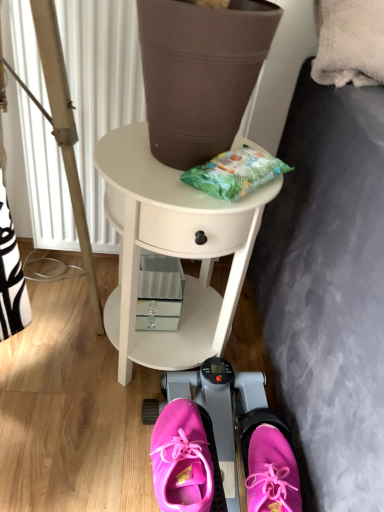
Question: Are wooden tripod at left and white glossy side table at center beside each other?

Choices:
 (A) no
 (B) yes

Answer: (A)

Question: Is wooden tripod at left taller than white glossy side table at center?

Choices:
 (A) yes
 (B) no

Answer: (A)

Question: Can you confirm if wooden tripod at left is smaller than white glossy side table at center?

Choices:
 (A) yes
 (B) no

Answer: (A)

Question: Is white glossy side table at center completely or partially inside wooden tripod at left?

Choices:
 (A) yes
 (B) no

Answer: (B)

Question: Is wooden tripod at left to the left of white glossy side table at center from the viewer's perspective?

Choices:
 (A) no
 (B) yes

Answer: (B)

Question: Is wooden tripod at left shorter than white glossy side table at center?

Choices:
 (A) no
 (B) yes

Answer: (A)

Question: Considering the relative positions of pink fabric shoe at lower center, the second footwear in the right-to-left sequence, and white glossy side table at center in the image provided, is pink fabric shoe at lower center, the second footwear in the right-to-left sequence, behind white glossy side table at center?

Choices:
 (A) no
 (B) yes

Answer: (A)

Question: From a real-world perspective, is pink fabric shoe at lower center, which is counted as the 1th footwear, starting from the left, positioned under white glossy side table at center based on gravity?

Choices:
 (A) no
 (B) yes

Answer: (B)

Question: Does pink fabric shoe at lower center, which is counted as the 1th footwear, starting from the left, contain white glossy side table at center?

Choices:
 (A) yes
 (B) no

Answer: (B)

Question: Considering the relative positions of pink fabric shoe at lower center, the second footwear in the right-to-left sequence, and white glossy side table at center in the image provided, is pink fabric shoe at lower center, the second footwear in the right-to-left sequence, to the right of white glossy side table at center from the viewer's perspective?

Choices:
 (A) yes
 (B) no

Answer: (A)

Question: From a real-world perspective, is pink fabric shoe at lower center, the second footwear in the right-to-left sequence, physically above white glossy side table at center?

Choices:
 (A) yes
 (B) no

Answer: (B)

Question: Is pink fabric shoe at lower center, the second footwear in the right-to-left sequence, wider than white glossy side table at center?

Choices:
 (A) no
 (B) yes

Answer: (A)

Question: Is the depth of pink fabric sneakers at lower center, placed as the second footwear when sorted from left to right, less than that of pink fabric sneakers at center?

Choices:
 (A) no
 (B) yes

Answer: (B)